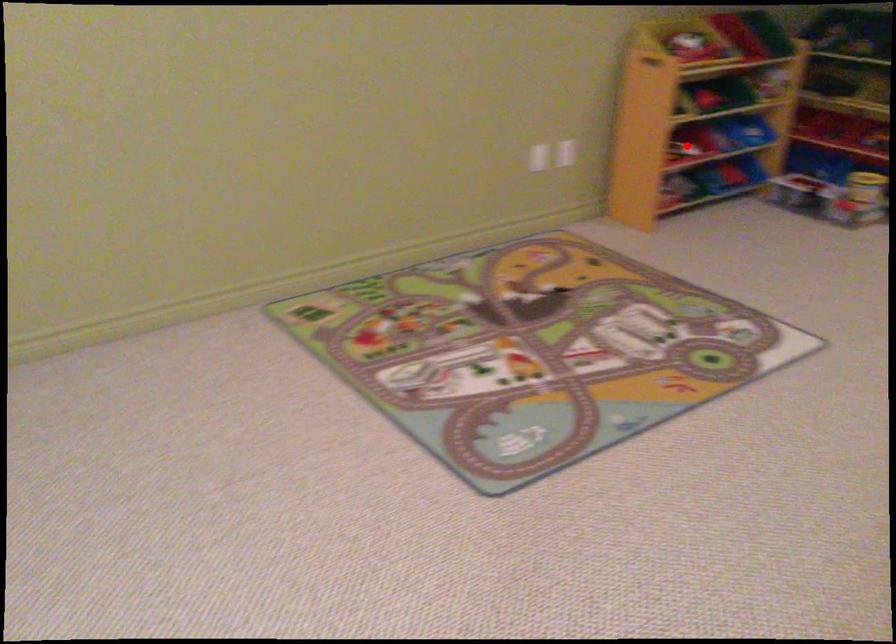
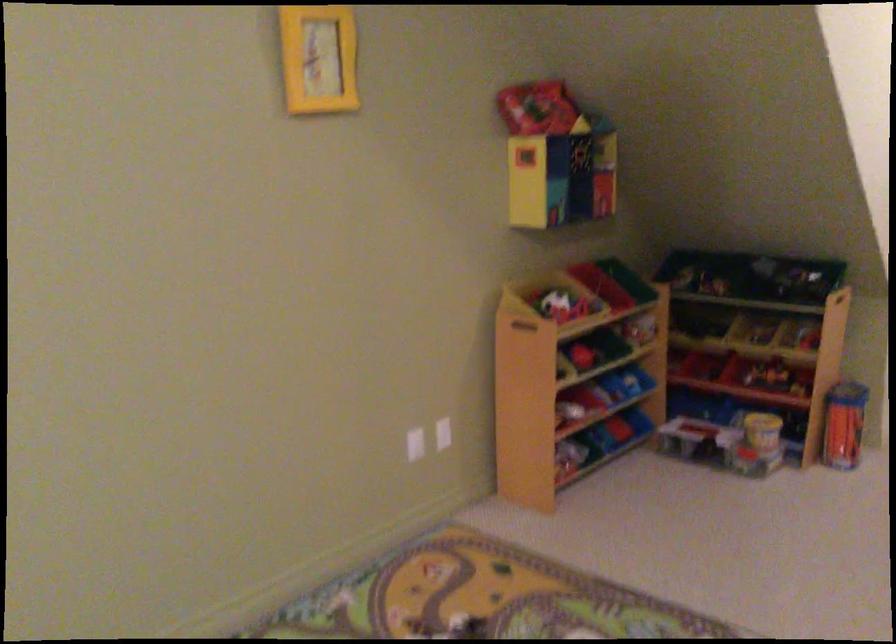
Question: I am providing you with two images of the same scene from different viewpoints. A red point is shown in image1. For the corresponding object point in image2, is it positioned nearer or farther from the camera?

Choices:
 (A) Nearer
 (B) Farther

Answer: (A)